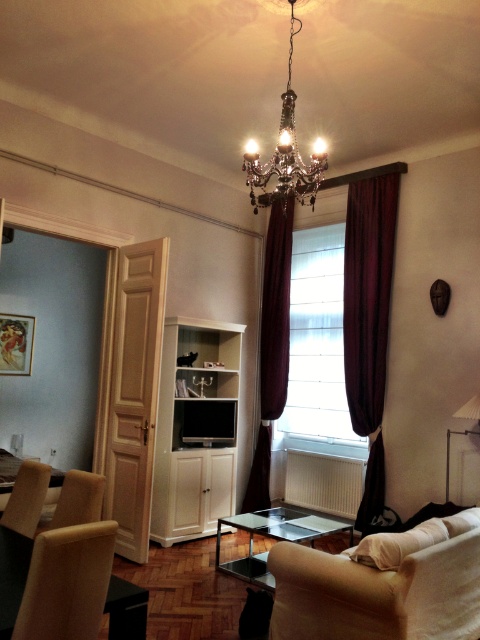
Question: Does velvet dark red curtain at right have a greater width compared to crystal glass chandelier at upper center?

Choices:
 (A) yes
 (B) no

Answer: (B)

Question: Which point appears farthest from the camera in this image?

Choices:
 (A) (288, 544)
 (B) (27, 468)

Answer: (B)

Question: Does beige fabric couch at lower right appear under transparent glass table at center?

Choices:
 (A) yes
 (B) no

Answer: (B)

Question: Estimate the real-world distances between objects in this image. Which object is farther from the velvet dark red curtain at center?

Choices:
 (A) crystal glass chandelier at upper center
 (B) wooden chair at lower left

Answer: (B)

Question: Considering the real-world distances, which object is closest to the velvet dark red curtain at center?

Choices:
 (A) velvet curtains at center
 (B) beige fabric couch at lower right
 (C) wooden table at lower left

Answer: (A)

Question: In this image, where is crystal glass chandelier at upper center located relative to transparent glass table at center?

Choices:
 (A) left
 (B) right

Answer: (B)